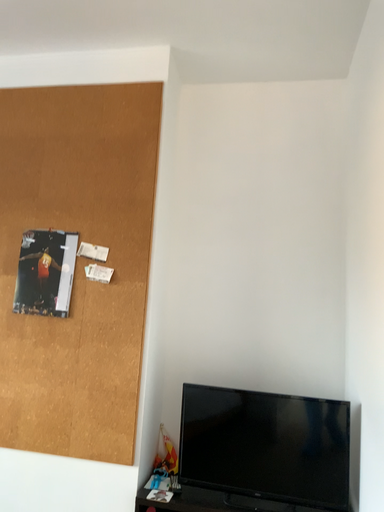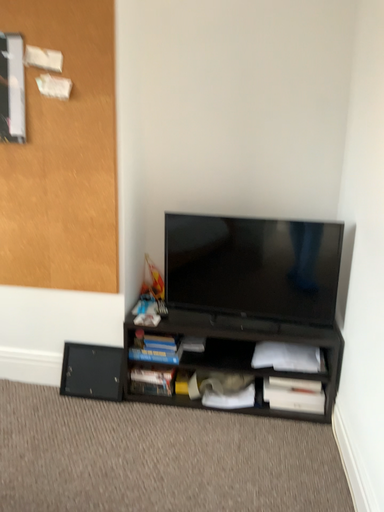
Question: How did the camera likely rotate when shooting the video?

Choices:
 (A) rotated upward
 (B) rotated downward

Answer: (B)